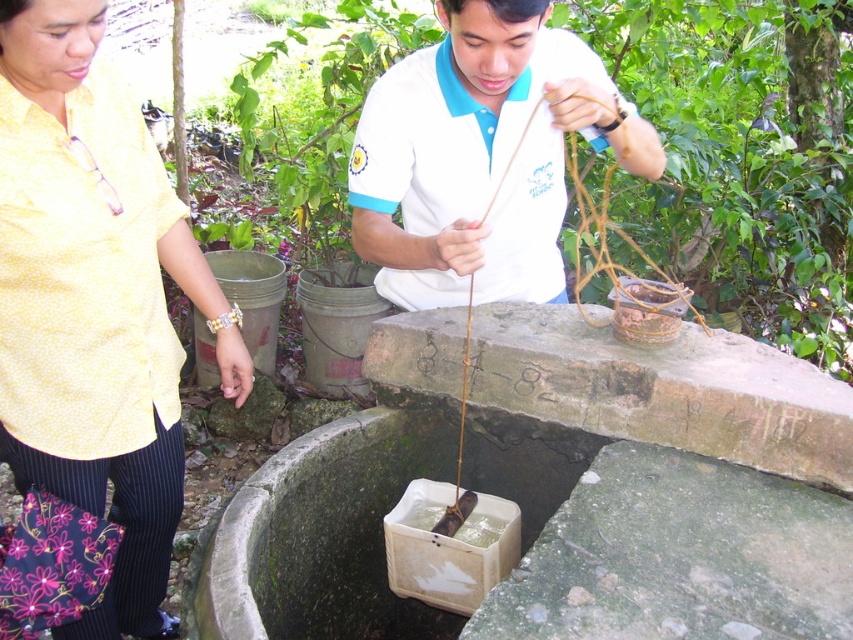
You are standing at the center of the image. Which direction should you move to reach the brown woven basket at center?

The brown woven basket at center is located at point coordinates of [741,157]. Since you are at the center, you should move to the left and down to reach it.

You are a delivery person with a package that is 2 meters long. You need to place the package between the brown woven basket at center and the yellow dotted shirt at upper left. Is there enough space to place the package horizontally between them?

The brown woven basket at center and yellow dotted shirt at upper left are 2.14 meters apart, so yes, the package can be placed horizontally between them since the distance is greater than the package length.